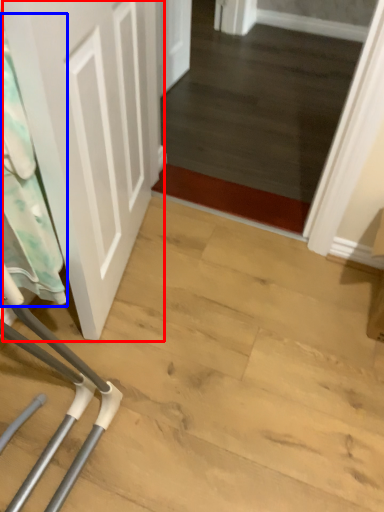
Question: Which object appears closest to the camera in this image, door (highlighted by a red box) or laundry (highlighted by a blue box)?

Choices:
 (A) door
 (B) laundry

Answer: (A)